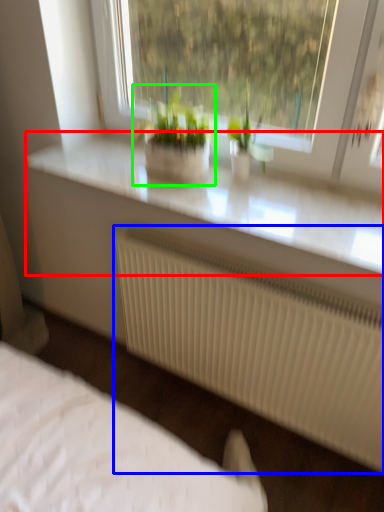
Question: Which object is the farthest from counter top (highlighted by a red box)? Choose among these: radiator (highlighted by a blue box) or houseplant (highlighted by a green box).

Choices:
 (A) radiator
 (B) houseplant

Answer: (A)